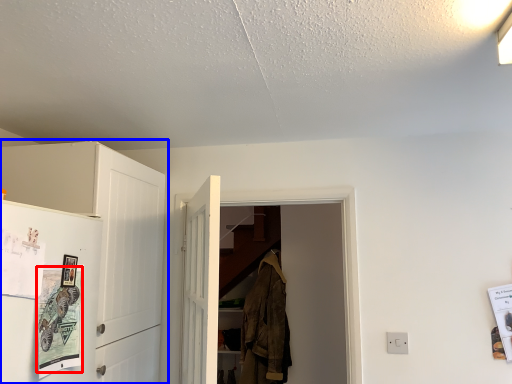
Question: Which object is further to the camera taking this photo, poster (highlighted by a red box) or cabinetry (highlighted by a blue box)?

Choices:
 (A) poster
 (B) cabinetry

Answer: (B)